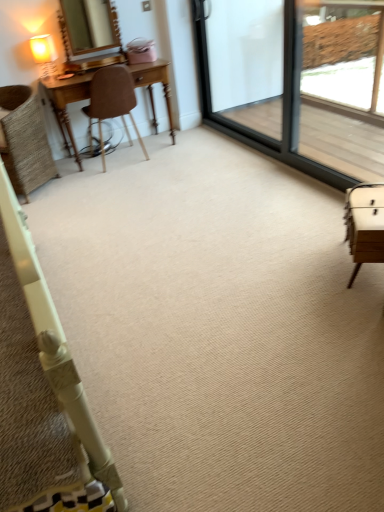
Image resolution: width=384 pixels, height=512 pixels. I want to click on space that is in front of wooden desk at left, so click(x=134, y=180).